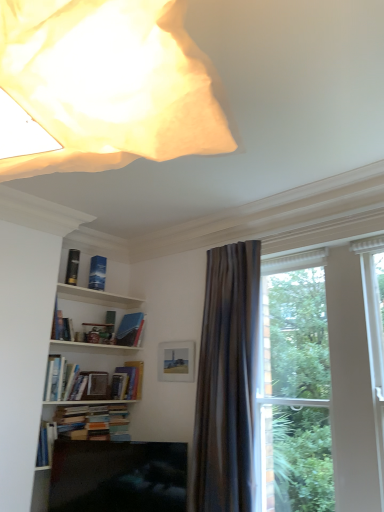
You are a GUI agent. You are given a task and a screenshot of the screen. Output one action in this format:
    pyautogui.click(x=<x>, y=<y>)
    Task: Click on the vacant location behind metallic gold bookshelf at upper left, positioned as the fifth book in bottom-to-top order
    This screenshot has height=512, width=384.
    Given the screenshot: What is the action you would take?
    pyautogui.click(x=76, y=290)